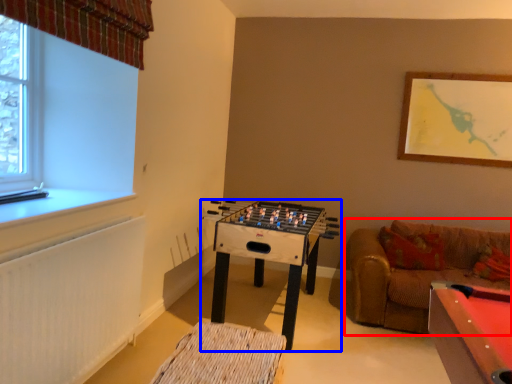
Question: Among these objects, which one is farthest to the camera, studio couch (highlighted by a red box) or table (highlighted by a blue box)?

Choices:
 (A) studio couch
 (B) table

Answer: (B)